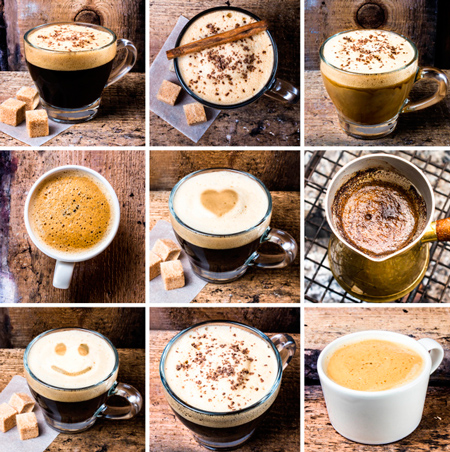
In order to click on handle on coffee mug in this screenshot , I will do `click(132, 398)`, `click(285, 339)`, `click(428, 341)`, `click(280, 240)`, `click(65, 274)`, `click(128, 45)`, `click(283, 84)`, `click(437, 74)`.